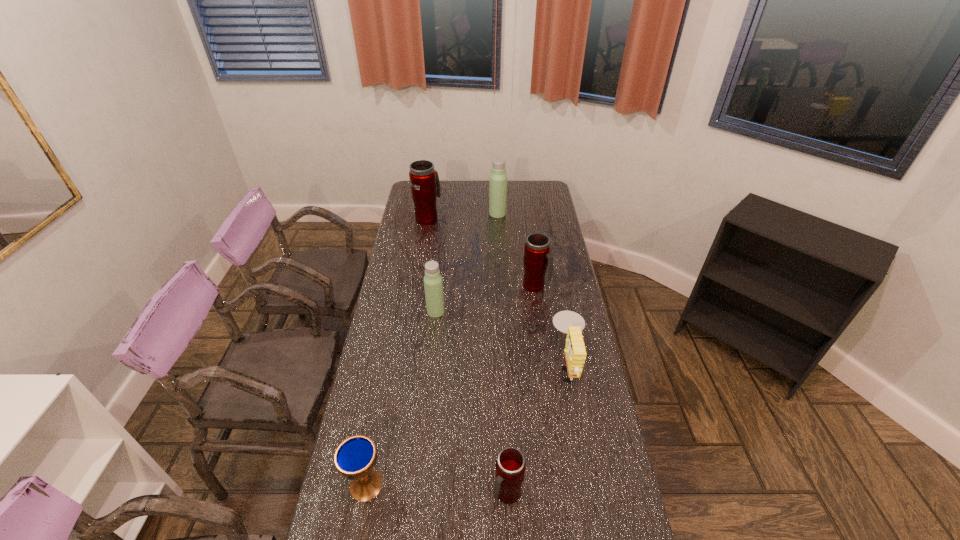
You are a GUI agent. You are given a task and a screenshot of the screen. Output one action in this format:
    pyautogui.click(x=<x>, y=<y>)
    Task: Click on the free space between the yellow sponge and the blue chalice
    The height and width of the screenshot is (540, 960).
    Given the screenshot: What is the action you would take?
    pyautogui.click(x=468, y=425)

This screenshot has width=960, height=540. I want to click on blank region between the chalice and the leftmost red thermos bottle, so click(x=397, y=352).

Locate an element on the screen. vacant point located between the third nearest object and the second farthest red thermos bottle is located at coordinates (552, 326).

At what (x,y) coordinates should I click in order to perform the action: click on free space between the chalice and the shortest thermos bottle. Please return your answer as a coordinate pair (x, y). Looking at the image, I should click on (437, 489).

Where is `free space between the nearest red thermos bottle and the right light thermos bottle`? The width and height of the screenshot is (960, 540). free space between the nearest red thermos bottle and the right light thermos bottle is located at coordinates (502, 353).

Find the location of a particular element. The image size is (960, 540). empty space between the fourth farthest thermos bottle and the second red thermos bottle from right to left is located at coordinates (471, 402).

Identify which object is located as the second nearest to the second red thermos bottle from right to left. Please provide its 2D coordinates. Your answer should be formatted as a tuple, i.e. [(x, y)], where the tuple contains the x and y coordinates of a point satisfying the conditions above.

[(355, 457)]

Select which object appears as the third closest to the fourth nearest object. Please provide its 2D coordinates. Your answer should be formatted as a tuple, i.e. [(x, y)], where the tuple contains the x and y coordinates of a point satisfying the conditions above.

[(425, 186)]

Select which thermos bottle is the third closest to the leftmost red thermos bottle. Please provide its 2D coordinates. Your answer should be formatted as a tuple, i.e. [(x, y)], where the tuple contains the x and y coordinates of a point satisfying the conditions above.

[(433, 284)]

Identify which thermos bottle is located as the third nearest to the leftmost red thermos bottle. Please provide its 2D coordinates. Your answer should be formatted as a tuple, i.e. [(x, y)], where the tuple contains the x and y coordinates of a point satisfying the conditions above.

[(433, 284)]